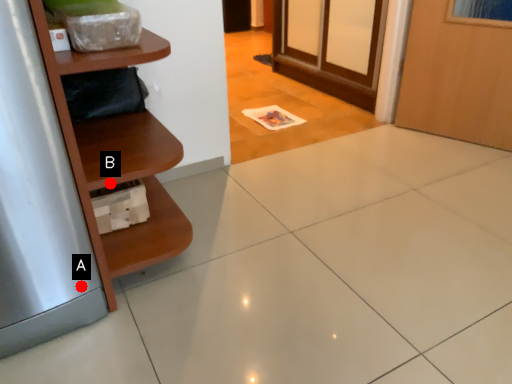
Question: Two points are circled on the image, labeled by A and B beside each circle. Which point is farther from the camera taking this photo?

Choices:
 (A) A is further
 (B) B is further

Answer: (A)